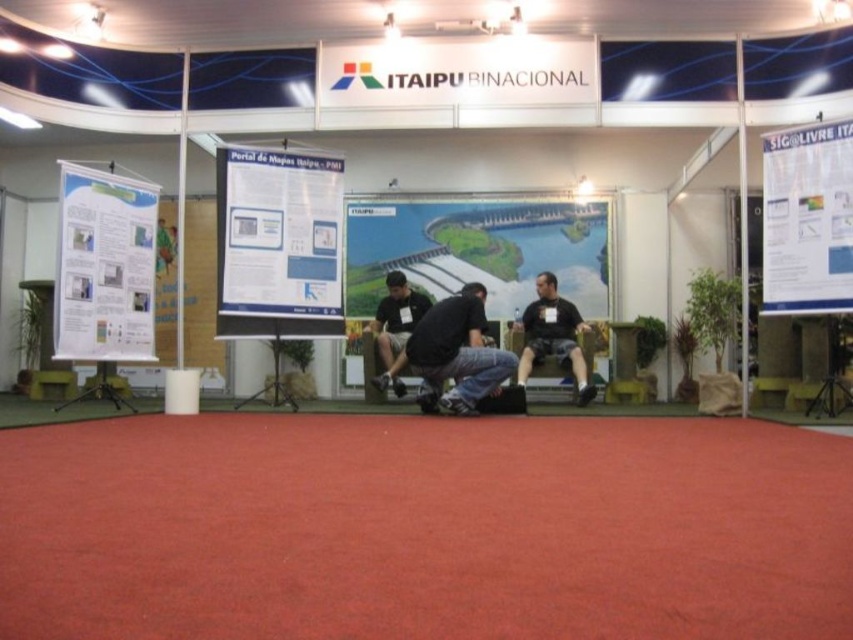
Between white paper poster at center and black matte shirt at center, which one has less height?

With less height is black matte shirt at center.

Locate an element on the screen. Image resolution: width=853 pixels, height=640 pixels. white paper poster at center is located at coordinates (277, 244).

Who is more forward, [762,262] or [554,278]?

Point [554,278] is in front.

Between point (811, 209) and point (518, 378), which one is positioned behind?

The point (518, 378) is more distant.

I want to click on white paper at upper right, so tap(807, 220).

Between black matte shirt at center and dark gray fabric shirt at center, which one has more height?

black matte shirt at center is taller.

This screenshot has width=853, height=640. I want to click on black matte shirt at center, so click(552, 336).

The width and height of the screenshot is (853, 640). Identify the location of black matte shirt at center. (552, 336).